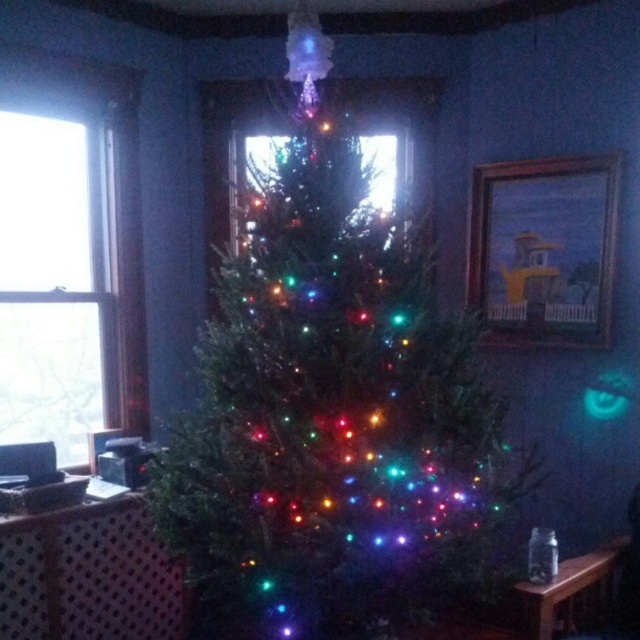
Question: Is iridescent plastic christmas tree at center thinner than transparent glass window at left?

Choices:
 (A) no
 (B) yes

Answer: (A)

Question: Which of the following is the closest to the observer?

Choices:
 (A) (257, 236)
 (B) (36, 300)

Answer: (A)

Question: Which point is farther to the camera?

Choices:
 (A) transparent glass window at left
 (B) iridescent plastic christmas tree at center

Answer: (A)

Question: Is iridescent plastic christmas tree at center wider than transparent glass window at left?

Choices:
 (A) no
 (B) yes

Answer: (B)

Question: Which point is closer to the camera?

Choices:
 (A) (332, 445)
 (B) (8, 364)

Answer: (A)

Question: Can you confirm if iridescent plastic christmas tree at center is smaller than transparent glass window at left?

Choices:
 (A) yes
 (B) no

Answer: (B)